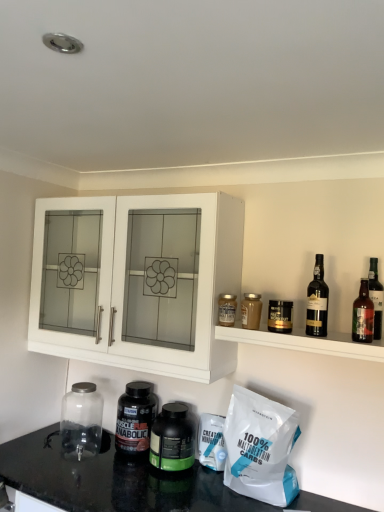
Question: Is green matte bottle at center, the fourth bottle positioned from the right, further to camera compared to white matte cabinet at upper left?

Choices:
 (A) yes
 (B) no

Answer: (A)

Question: Is green matte bottle at center, positioned as the first bottle in bottom-to-top order, oriented away from white matte cabinet at upper left?

Choices:
 (A) no
 (B) yes

Answer: (A)

Question: Can you confirm if green matte bottle at center, marked as the 2th bottle in a left-to-right arrangement, is wider than white matte cabinet at upper left?

Choices:
 (A) no
 (B) yes

Answer: (A)

Question: Is green matte bottle at center, marked as the 2th bottle in a left-to-right arrangement, completely or partially outside of white matte cabinet at upper left?

Choices:
 (A) no
 (B) yes

Answer: (B)

Question: Is green matte bottle at center, marked as the 2th bottle in a left-to-right arrangement, thinner than white matte cabinet at upper left?

Choices:
 (A) no
 (B) yes

Answer: (B)

Question: Relative to brown glass bottle at right, is dark glass bottle at shelf right in front or behind?

Choices:
 (A) behind
 (B) front

Answer: (B)

Question: Would you say dark glass bottle at shelf right is to the left or to the right of brown glass bottle at right in the picture?

Choices:
 (A) left
 (B) right

Answer: (A)

Question: In terms of height, does dark glass bottle at shelf right look taller or shorter compared to brown glass bottle at right?

Choices:
 (A) tall
 (B) short

Answer: (A)

Question: Based on their sizes in the image, would you say dark glass bottle at shelf right is bigger or smaller than brown glass bottle at right?

Choices:
 (A) big
 (B) small

Answer: (A)

Question: From their relative heights in the image, would you say white matte bag of 100% maltodextrin carbs at lower right is taller or shorter than white matte cabinet at upper left?

Choices:
 (A) short
 (B) tall

Answer: (A)

Question: From a real-world perspective, is white matte bag of 100% maltodextrin carbs at lower right positioned above or below white matte cabinet at upper left?

Choices:
 (A) above
 (B) below

Answer: (B)

Question: In the image, is white matte bag of 100% maltodextrin carbs at lower right on the left side or the right side of white matte cabinet at upper left?

Choices:
 (A) left
 (B) right

Answer: (B)

Question: From the image's perspective, is white matte bag of 100% maltodextrin carbs at lower right above or below white matte cabinet at upper left?

Choices:
 (A) above
 (B) below

Answer: (B)

Question: Based on their sizes in the image, would you say black plastic bottle at lower center, positioned as the 1th bottle in left-to-right order, is bigger or smaller than white matte bag of 100% maltodextrin carbs at lower right?

Choices:
 (A) big
 (B) small

Answer: (B)

Question: From the image's perspective, is black plastic bottle at lower center, which ranks as the 4th bottle in top-to-bottom order, positioned above or below white matte bag of 100% maltodextrin carbs at lower right?

Choices:
 (A) below
 (B) above

Answer: (A)